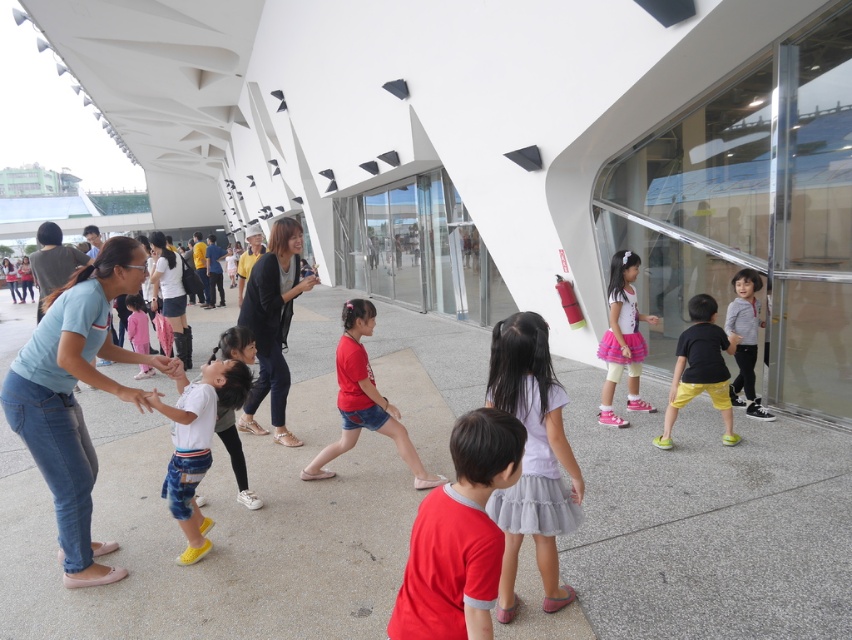
Question: In this image, where is pink satin skirt at center located relative to pink fabric dress at center?

Choices:
 (A) right
 (B) left

Answer: (A)

Question: Which of the following is the farthest from the observer?

Choices:
 (A) (724, 406)
 (B) (56, 513)
 (C) (245, 385)
 (D) (550, 536)

Answer: (A)

Question: Which point is closer to the camera?

Choices:
 (A) pink fabric dress at center
 (B) matte black jacket at upper left

Answer: (B)

Question: Does red denim shorts at center appear over pink fabric dress at center?

Choices:
 (A) no
 (B) yes

Answer: (A)

Question: Is matte red shirt at center positioned behind pink fabric dress at center?

Choices:
 (A) yes
 (B) no

Answer: (B)

Question: Which is farther from the black matte shirt at center?

Choices:
 (A) striped cotton shirt at right
 (B) matte black jacket at center
 (C) red denim shorts at center

Answer: (B)